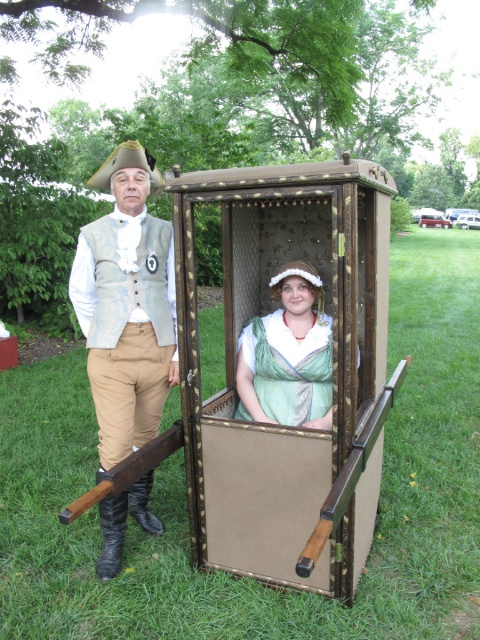
You are a historical reenactor dressed in period clothing, and you need to retrieve an item from the wooden cage at center. Considering your height and the cage height, can you reach the item without assistance?

The wooden cage at center is 1.57 meters away from the camera, but the description does not provide information about its height. Therefore, it is impossible to determine if you can reach the item without assistance based on the given details.